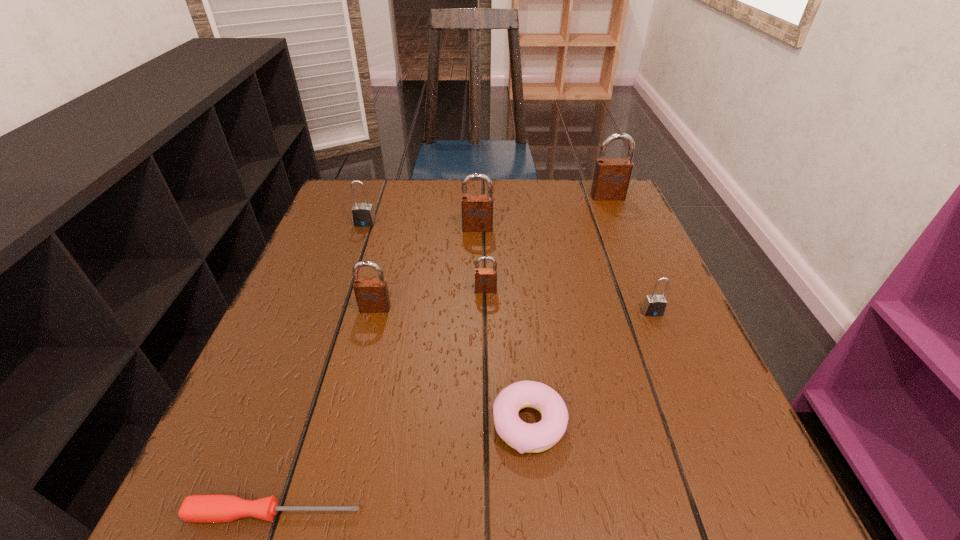
This screenshot has width=960, height=540. I want to click on free space between the bigger gray padlock and the seventh farthest object, so click(x=447, y=323).

The width and height of the screenshot is (960, 540). What are the coordinates of `vacant point located between the bigger gray padlock and the second farthest brown padlock` in the screenshot? It's located at (421, 226).

Where is `free space between the farthest brown padlock and the pink doughnut`? The image size is (960, 540). free space between the farthest brown padlock and the pink doughnut is located at coordinates (568, 310).

You are a GUI agent. You are given a task and a screenshot of the screen. Output one action in this format:
    pyautogui.click(x=<x>, y=<y>)
    Task: Click on the empty location between the rightmost brown padlock and the pink doughnut
    
    Given the screenshot: What is the action you would take?
    [568, 310]

At what (x,y) coordinates should I click in order to perform the action: click on vacant space that's between the biggest brown padlock and the third farthest brown padlock. Please return your answer as a coordinate pair (x, y). Image resolution: width=960 pixels, height=540 pixels. Looking at the image, I should click on (547, 244).

The image size is (960, 540). I want to click on vacant space in between the third biggest brown padlock and the second tallest object, so click(x=426, y=268).

I want to click on object that is the second nearest to the left gray padlock, so click(372, 296).

Where is `object that is the second closest one to the farthest padlock`? object that is the second closest one to the farthest padlock is located at coordinates (654, 305).

Identify the location of the second closest padlock to the third biggest brown padlock. (363, 215).

Locate an element on the screen. The width and height of the screenshot is (960, 540). padlock identified as the third closest to the smaller gray padlock is located at coordinates (611, 178).